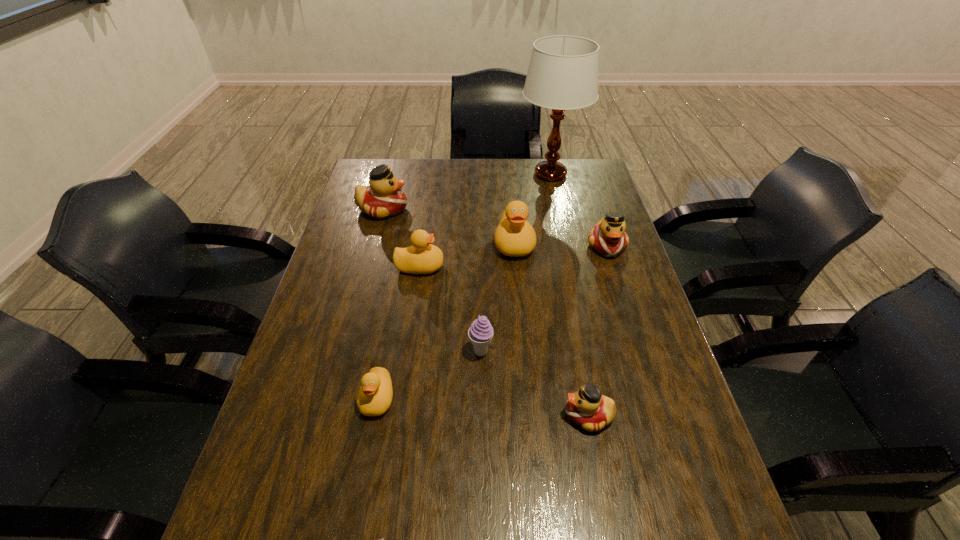
The image size is (960, 540). Find the location of `vacant space at the left edge`. vacant space at the left edge is located at coordinates (267, 486).

In the image, there is a desktop. Where is `vacant space at the right edge`? Image resolution: width=960 pixels, height=540 pixels. vacant space at the right edge is located at coordinates (630, 363).

Where is `vacant space that is in between the farthest duck and the rightmost red duck`? The image size is (960, 540). vacant space that is in between the farthest duck and the rightmost red duck is located at coordinates (494, 227).

I want to click on free space between the third duck from right to left and the smallest red duck, so click(x=551, y=329).

Locate an element on the screen. free point between the biggest red duck and the second biggest yellow duck is located at coordinates (401, 238).

What are the coordinates of `free point between the second biggest yellow duck and the icecream` in the screenshot? It's located at (450, 309).

Find the location of `unoccupied position between the second duck from right to left and the second farthest object`. unoccupied position between the second duck from right to left and the second farthest object is located at coordinates (486, 312).

Image resolution: width=960 pixels, height=540 pixels. Identify the location of empty space between the rightmost yellow duck and the second biggest yellow duck. (468, 255).

At what (x,y) coordinates should I click in order to perform the action: click on vacant space that is in between the third duck from right to left and the smallest red duck. Please return your answer as a coordinate pair (x, y). Looking at the image, I should click on (551, 329).

This screenshot has width=960, height=540. Find the location of `blank region between the rightmost duck and the nearest yellow duck`. blank region between the rightmost duck and the nearest yellow duck is located at coordinates (492, 322).